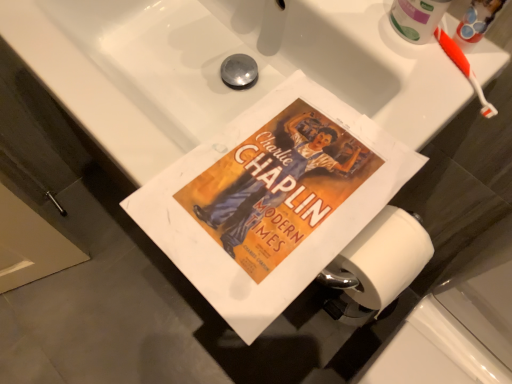
What do you see at coordinates (464, 69) in the screenshot? The image size is (512, 384). I see `orange plastic toothbrush at upper right` at bounding box center [464, 69].

In order to click on orange plastic toothbrush at upper right in this screenshot , I will do `click(464, 69)`.

The image size is (512, 384). Describe the element at coordinates (272, 200) in the screenshot. I see `matte paper poster at center` at that location.

Where is `matte paper poster at center`? The width and height of the screenshot is (512, 384). matte paper poster at center is located at coordinates (272, 200).

The image size is (512, 384). Identify the location of orange plastic toothbrush at upper right. (464, 69).

Is orange plastic toothbrush at upper right to the right of matte paper poster at center from the viewer's perspective?

Yes, orange plastic toothbrush at upper right is to the right of matte paper poster at center.

Between orange plastic toothbrush at upper right and matte paper poster at center, which one is positioned behind?

orange plastic toothbrush at upper right.

Between point (459, 61) and point (305, 147), which one is positioned behind?

The point (459, 61) is farther from the camera.

From the image's perspective, does orange plastic toothbrush at upper right appear lower than matte paper poster at center?

Actually, orange plastic toothbrush at upper right appears above matte paper poster at center in the image.

From the picture: From a real-world perspective, between orange plastic toothbrush at upper right and matte paper poster at center, who is vertically lower?

matte paper poster at center, from a real-world perspective.

Which object is thinner, orange plastic toothbrush at upper right or matte paper poster at center?

With smaller width is orange plastic toothbrush at upper right.

From the picture: Does orange plastic toothbrush at upper right have a greater height compared to matte paper poster at center?

Correct, orange plastic toothbrush at upper right is much taller as matte paper poster at center.

Considering the sizes of objects orange plastic toothbrush at upper right and matte paper poster at center in the image provided, who is bigger, orange plastic toothbrush at upper right or matte paper poster at center?

matte paper poster at center.

In the scene shown: Is orange plastic toothbrush at upper right outside of matte paper poster at center?

Absolutely, orange plastic toothbrush at upper right is external to matte paper poster at center.

Is there a large distance between orange plastic toothbrush at upper right and matte paper poster at center?

No, there isn't a large distance between orange plastic toothbrush at upper right and matte paper poster at center.

Is orange plastic toothbrush at upper right oriented away from matte paper poster at center?

No.

How different are the orientations of orange plastic toothbrush at upper right and matte paper poster at center in degrees?

21.5 degrees separate the facing orientations of orange plastic toothbrush at upper right and matte paper poster at center.

You are a GUI agent. You are given a task and a screenshot of the screen. Output one action in this format:
    pyautogui.click(x=<x>, y=<y>)
    Task: Click on the toothbrush behind the matte paper poster at center
    
    Given the screenshot: What is the action you would take?
    pyautogui.click(x=464, y=69)

Is matte paper poster at center to the left of orange plastic toothbrush at upper right from the viewer's perspective?

Indeed, matte paper poster at center is positioned on the left side of orange plastic toothbrush at upper right.

Considering the positions of objects matte paper poster at center and orange plastic toothbrush at upper right in the image provided, who is in front, matte paper poster at center or orange plastic toothbrush at upper right?

Positioned in front is matte paper poster at center.

Is point (329, 210) positioned after point (463, 60)?

No, (329, 210) is closer to viewer.

From the image's perspective, is matte paper poster at center above orange plastic toothbrush at upper right?

Actually, matte paper poster at center appears below orange plastic toothbrush at upper right in the image.

From a real-world perspective, relative to orange plastic toothbrush at upper right, is matte paper poster at center vertically above or below?

matte paper poster at center is situated lower than orange plastic toothbrush at upper right in the real world.

Which of these two, matte paper poster at center or orange plastic toothbrush at upper right, is thinner?

With smaller width is orange plastic toothbrush at upper right.

Can you confirm if matte paper poster at center is taller than orange plastic toothbrush at upper right?

In fact, matte paper poster at center may be shorter than orange plastic toothbrush at upper right.

Does matte paper poster at center have a larger size compared to orange plastic toothbrush at upper right?

Indeed, matte paper poster at center has a larger size compared to orange plastic toothbrush at upper right.

Which is correct: matte paper poster at center is inside orange plastic toothbrush at upper right, or outside of it?

matte paper poster at center is located beyond the bounds of orange plastic toothbrush at upper right.

Is there a large distance between matte paper poster at center and orange plastic toothbrush at upper right?

matte paper poster at center is actually quite close to orange plastic toothbrush at upper right.

Is matte paper poster at center facing towards orange plastic toothbrush at upper right?

No, matte paper poster at center is not aimed at orange plastic toothbrush at upper right.

Can you tell me how much matte paper poster at center and orange plastic toothbrush at upper right differ in facing direction?

matte paper poster at center and orange plastic toothbrush at upper right are facing 21.5 degrees away from each other.

The width and height of the screenshot is (512, 384). In the image, there is a orange plastic toothbrush at upper right. What are the coordinates of `paperback book below it (from a real-world perspective)` in the screenshot? It's located at (272, 200).

This screenshot has width=512, height=384. I want to click on paperback book on the left of the orange plastic toothbrush at upper right, so click(x=272, y=200).

I want to click on toothbrush lying above the matte paper poster at center (from the image's perspective), so click(464, 69).